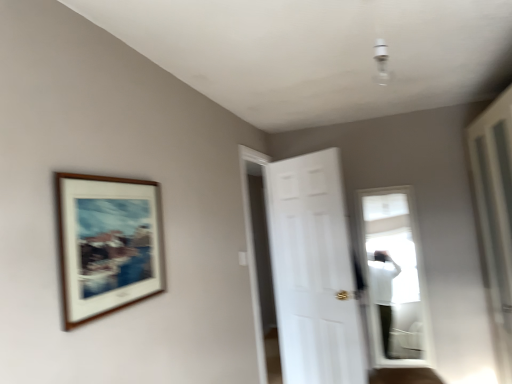
You are a GUI agent. You are given a task and a screenshot of the screen. Output one action in this format:
    pyautogui.click(x=<x>, y=<y>)
    Task: Click on the white matte door at center
    The height and width of the screenshot is (384, 512).
    Given the screenshot: What is the action you would take?
    pyautogui.click(x=313, y=271)

Image resolution: width=512 pixels, height=384 pixels. What do you see at coordinates (313, 271) in the screenshot? I see `white matte door at center` at bounding box center [313, 271].

What do you see at coordinates (106, 244) in the screenshot?
I see `wooden frame at upper left` at bounding box center [106, 244].

Image resolution: width=512 pixels, height=384 pixels. Find the location of `wooden frame at upper left`. wooden frame at upper left is located at coordinates (106, 244).

At what (x,y) coordinates should I click in order to perform the action: click on white matte door at center. Please return your answer as a coordinate pair (x, y). The width and height of the screenshot is (512, 384). Looking at the image, I should click on (313, 271).

Based on the photo, considering the relative positions of wooden frame at upper left and white matte door at center in the image provided, is wooden frame at upper left to the left of white matte door at center from the viewer's perspective?

Yes, wooden frame at upper left is to the left of white matte door at center.

Which is in front, wooden frame at upper left or white matte door at center?

wooden frame at upper left is in front.

Which is in front, point (95, 240) or point (303, 360)?

Point (95, 240)

From the image's perspective, is wooden frame at upper left on white matte door at center?

Indeed, from the image's perspective, wooden frame at upper left is shown above white matte door at center.

From a real-world perspective, is wooden frame at upper left above or below white matte door at center?

Clearly, from a real-world perspective, wooden frame at upper left is above white matte door at center.

Does wooden frame at upper left have a greater width compared to white matte door at center?

No, wooden frame at upper left is not wider than white matte door at center.

Between wooden frame at upper left and white matte door at center, which one has more height?

Standing taller between the two is white matte door at center.

Considering the relative sizes of wooden frame at upper left and white matte door at center in the image provided, is wooden frame at upper left smaller than white matte door at center?

Correct, wooden frame at upper left occupies less space than white matte door at center.

Is wooden frame at upper left located outside white matte door at center?

Yes.

Is wooden frame at upper left next to white matte door at center and touching it?

No.

In the scene shown: Could you tell me if wooden frame at upper left is turned towards white matte door at center?

No.

Can you tell me how much wooden frame at upper left and white matte door at center differ in facing direction?

wooden frame at upper left and white matte door at center are facing 125 degrees away from each other.

How much distance is there between wooden frame at upper left and white matte door at center?

They are 6.20 feet apart.

Find the location of a particular element. This screenshot has width=512, height=384. door that appears below the wooden frame at upper left (from the image's perspective) is located at coordinates (313, 271).

Consider the image. Considering the relative positions of white matte door at center and wooden frame at upper left in the image provided, is white matte door at center to the right of wooden frame at upper left from the viewer's perspective?

Yes.

Is white matte door at center in front of or behind wooden frame at upper left in the image?

Visually, white matte door at center is located behind wooden frame at upper left.

Between point (332, 274) and point (124, 250), which one is positioned in front?

Positioned in front is point (124, 250).

From the image's perspective, which is below, white matte door at center or wooden frame at upper left?

white matte door at center appears lower in the image.

From a real-world perspective, is white matte door at center physically below wooden frame at upper left?

Correct, in the physical world, white matte door at center is lower than wooden frame at upper left.

Considering the sizes of objects white matte door at center and wooden frame at upper left in the image provided, who is wider, white matte door at center or wooden frame at upper left?

white matte door at center is wider.

Can you confirm if white matte door at center is shorter than wooden frame at upper left?

Incorrect, the height of white matte door at center does not fall short of that of wooden frame at upper left.

Based on the photo, who is bigger, white matte door at center or wooden frame at upper left?

white matte door at center is bigger.

Would you say white matte door at center contains wooden frame at upper left?

No, wooden frame at upper left is not a part of white matte door at center.

Is white matte door at center with wooden frame at upper left?

white matte door at center and wooden frame at upper left are not in contact.

Is white matte door at center facing towards wooden frame at upper left?

No, white matte door at center does not turn towards wooden frame at upper left.

Can you tell me how much white matte door at center and wooden frame at upper left differ in facing direction?

125 degrees separate the facing orientations of white matte door at center and wooden frame at upper left.

This screenshot has height=384, width=512. In order to click on door below the wooden frame at upper left (from the image's perspective) in this screenshot , I will do `click(313, 271)`.

In the image, there is a wooden frame at upper left. At what (x,y) coordinates should I click in order to perform the action: click on door below it (from a real-world perspective). Please return your answer as a coordinate pair (x, y). This screenshot has width=512, height=384. Looking at the image, I should click on (313, 271).

The height and width of the screenshot is (384, 512). I want to click on picture frame above the white matte door at center (from the image's perspective), so (106, 244).